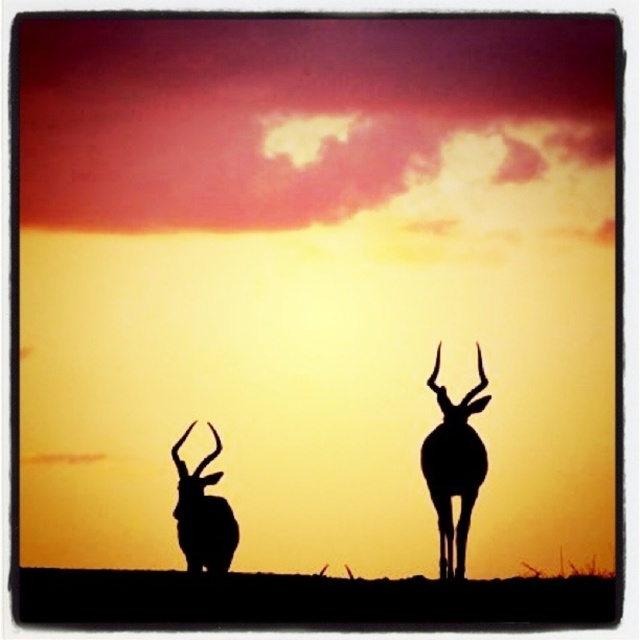
Question: Does silhouette antelope at center have a greater width compared to black matte/deer at left?

Choices:
 (A) yes
 (B) no

Answer: (A)

Question: Does silhouette antelope at center have a larger size compared to black matte/deer at left?

Choices:
 (A) no
 (B) yes

Answer: (B)

Question: Can you confirm if silhouette antelope at center is positioned above black matte/deer at left?

Choices:
 (A) yes
 (B) no

Answer: (A)

Question: Which of the following is the farthest from the observer?

Choices:
 (A) pos(449,548)
 (B) pos(209,564)

Answer: (B)

Question: Which object appears closest to the camera in this image?

Choices:
 (A) black matte/deer at left
 (B) silhouette antelope at center

Answer: (A)